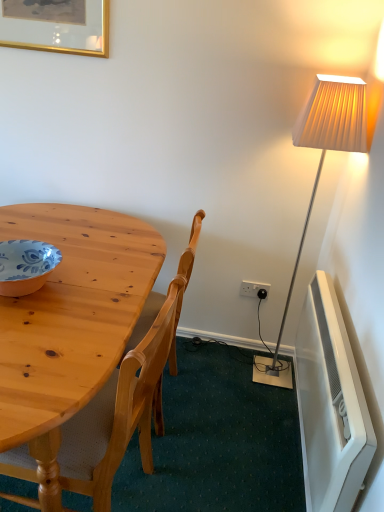
Where is `gold-framed picture at upper left`? gold-framed picture at upper left is located at coordinates (56, 26).

Locate an element on the screen. The height and width of the screenshot is (512, 384). white plastic power outlet at lower right is located at coordinates (253, 288).

In the scene shown: Which is more to the right, matte orange bowl at left or gold-framed picture at upper left?

From the viewer's perspective, matte orange bowl at left appears more on the right side.

Can you tell me how much matte orange bowl at left and gold-framed picture at upper left differ in facing direction?

The angle between the facing direction of matte orange bowl at left and the facing direction of gold-framed picture at upper left is 0.279 degrees.

Considering the sizes of objects matte orange bowl at left and gold-framed picture at upper left in the image provided, who is thinner, matte orange bowl at left or gold-framed picture at upper left?

Thinner between the two is gold-framed picture at upper left.

Looking at this image, from the image's perspective, would you say matte orange bowl at left is positioned over gold-framed picture at upper left?

No, from the image's perspective, matte orange bowl at left is not on top of gold-framed picture at upper left.

Is point (304, 471) less distant than point (34, 273)?

No, (304, 471) is behind (34, 273).

Image resolution: width=384 pixels, height=512 pixels. I want to click on bowl above the white plastic radiator at lower right (from the image's perspective), so click(x=26, y=266).

Is white plastic radiator at lower right with matte orange bowl at left?

They are not placed beside each other.

Would you say white plastic radiator at lower right is outside matte orange bowl at left?

That's correct, white plastic radiator at lower right is outside of matte orange bowl at left.

Choose the correct answer: Is white plastic power outlet at lower right inside white plastic radiator at lower right or outside it?

white plastic power outlet at lower right exists outside the volume of white plastic radiator at lower right.

Is white plastic power outlet at lower right touching white plastic radiator at lower right?

No, white plastic power outlet at lower right is not next to white plastic radiator at lower right.

Looking at this image, in the image, is white plastic power outlet at lower right on the left side or the right side of white plastic radiator at lower right?

white plastic power outlet at lower right is positioned on white plastic radiator at lower right's left side.

Considering the sizes of objects white plastic power outlet at lower right and white plastic radiator at lower right in the image provided, who is bigger, white plastic power outlet at lower right or white plastic radiator at lower right?

Bigger between the two is white plastic radiator at lower right.

In the scene shown: Considering the relative positions of matte orange bowl at left and white plastic radiator at lower right in the image provided, is matte orange bowl at left to the left of white plastic radiator at lower right from the viewer's perspective?

Yes.

Which is in front, point (5, 250) or point (331, 474)?

The point (331, 474) is closer.

Which of these two, matte orange bowl at left or white plastic radiator at lower right, is bigger?

white plastic radiator at lower right.

From the picture: Does matte orange bowl at left have a greater width compared to white plastic radiator at lower right?

Yes, matte orange bowl at left is wider than white plastic radiator at lower right.

Between gold-framed picture at upper left and matte orange bowl at left, which one appears on the right side from the viewer's perspective?

From the viewer's perspective, matte orange bowl at left appears more on the right side.

From a real-world perspective, does gold-framed picture at upper left stand above matte orange bowl at left?

Yes, from a real-world perspective, gold-framed picture at upper left is above matte orange bowl at left.

From the image's perspective, which object appears higher, gold-framed picture at upper left or matte orange bowl at left?

gold-framed picture at upper left is shown above in the image.

Is natural wood chair at left far from matte orange bowl at left?

No.

From a real-world perspective, between natural wood chair at left and matte orange bowl at left, who is vertically lower?

natural wood chair at left.

Considering the sizes of natural wood chair at left and matte orange bowl at left in the image, is natural wood chair at left wider or thinner than matte orange bowl at left?

natural wood chair at left is wider than matte orange bowl at left.

Is natural wood chair at left inside or outside of matte orange bowl at left?

natural wood chair at left is spatially situated outside matte orange bowl at left.

From the image's perspective, is white plastic radiator at lower right on white plastic power outlet at lower right?

No, from the image's perspective, white plastic radiator at lower right is not above white plastic power outlet at lower right.

Considering the positions of objects white plastic radiator at lower right and white plastic power outlet at lower right in the image provided, who is in front, white plastic radiator at lower right or white plastic power outlet at lower right?

white plastic radiator at lower right.

From a real-world perspective, is white plastic radiator at lower right located beneath white plastic power outlet at lower right?

No, from a real-world perspective, white plastic radiator at lower right is not below white plastic power outlet at lower right.

Between white plastic radiator at lower right and white plastic power outlet at lower right, which one has smaller size?

white plastic power outlet at lower right is smaller.

Identify the location of picture frame that appears on the left of matte orange bowl at left. This screenshot has width=384, height=512. (56, 26).

Locate an element on the screen. This screenshot has width=384, height=512. radiator that appears below the matte orange bowl at left (from the image's perspective) is located at coordinates (330, 404).

Which object lies nearer to the anchor point matte orange bowl at left, natural wood chair at left or gold-framed picture at upper left?

natural wood chair at left.

From the image, which object appears to be farther from white plastic radiator at lower right, matte orange bowl at left or gold-framed picture at upper left?

gold-framed picture at upper left lies further to white plastic radiator at lower right than the other object.

Considering their positions, is gold-framed picture at upper left positioned further to white plastic power outlet at lower right than white plastic radiator at lower right?

gold-framed picture at upper left is positioned further to the anchor white plastic power outlet at lower right.

Estimate the real-world distances between objects in this image. Which object is further from gold-framed picture at upper left, natural wood chair at left or white plastic power outlet at lower right?

white plastic power outlet at lower right is positioned further to the anchor gold-framed picture at upper left.

Looking at the image, which one is located closer to gold-framed picture at upper left, natural wood chair at left or white plastic radiator at lower right?

natural wood chair at left.

Looking at the image, which one is located closer to natural wood chair at left, white plastic radiator at lower right or gold-framed picture at upper left?

white plastic radiator at lower right lies closer to natural wood chair at left than the other object.

Estimate the real-world distances between objects in this image. Which object is further from gold-framed picture at upper left, white plastic radiator at lower right or white plastic power outlet at lower right?

Among the two, white plastic radiator at lower right is located further to gold-framed picture at upper left.

Estimate the real-world distances between objects in this image. Which object is further from natural wood chair at left, gold-framed picture at upper left or white plastic radiator at lower right?

The object further to natural wood chair at left is gold-framed picture at upper left.

This screenshot has width=384, height=512. I want to click on bowl between gold-framed picture at upper left and white plastic radiator at lower right from top to bottom, so click(x=26, y=266).

The height and width of the screenshot is (512, 384). Find the location of `power outlet between gold-framed picture at upper left and white plastic radiator at lower right in the up-down direction`. power outlet between gold-framed picture at upper left and white plastic radiator at lower right in the up-down direction is located at coordinates (253, 288).

This screenshot has width=384, height=512. I want to click on radiator between gold-framed picture at upper left and natural wood chair at left from top to bottom, so click(330, 404).

Find the location of a particular element. This screenshot has width=384, height=512. bowl between gold-framed picture at upper left and natural wood chair at left vertically is located at coordinates (26, 266).